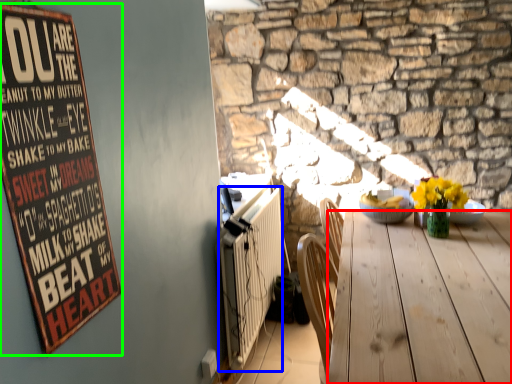
Question: Which object is the farthest from desk (highlighted by a red box)? Choose among these: radiator (highlighted by a blue box) or bulletin board (highlighted by a green box).

Choices:
 (A) radiator
 (B) bulletin board

Answer: (B)